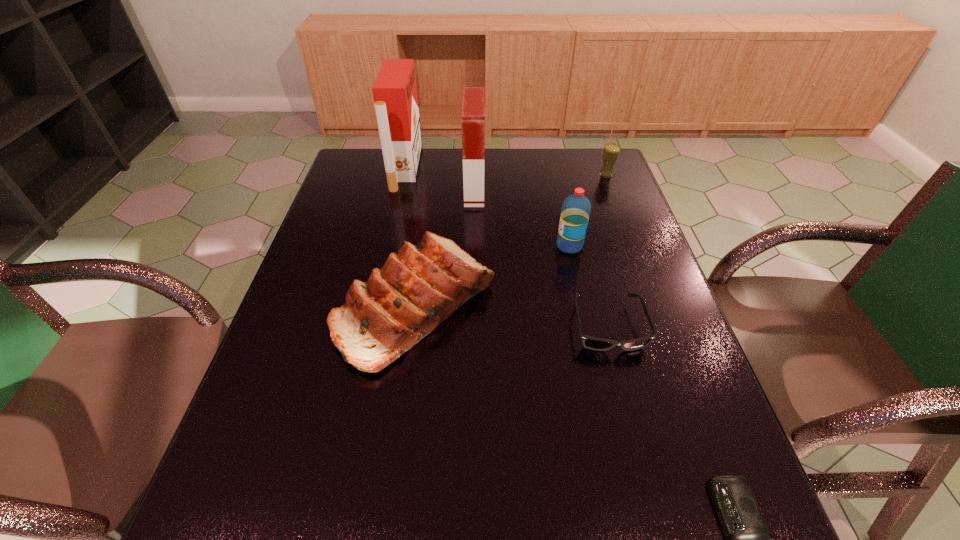
This screenshot has width=960, height=540. Identify the location of vacant area between the left cigarette_case and the sunglasses. (507, 247).

The height and width of the screenshot is (540, 960). I want to click on empty space that is in between the right cigarette_case and the second shortest object, so click(541, 258).

Locate which object ranks in proximity to the left cigarette_case. Please provide its 2D coordinates. Your answer should be formatted as a tuple, i.e. [(x, y)], where the tuple contains the x and y coordinates of a point satisfying the conditions above.

[(473, 103)]

Locate an element on the screen. This screenshot has height=540, width=960. object identified as the fourth closest to the right cigarette_case is located at coordinates (611, 151).

I want to click on vacant space that satisfies the following two spatial constraints: 1. on the back side of the bread; 2. on the front-facing side of the left cigarette_case, so click(x=435, y=168).

You are a GUI agent. You are given a task and a screenshot of the screen. Output one action in this format:
    pyautogui.click(x=<x>, y=<y>)
    Task: Click on the free spot that satisfies the following two spatial constraints: 1. on the front-facing side of the third shortest object; 2. on the left side of the left cigarette_case
    The image size is (960, 540).
    Given the screenshot: What is the action you would take?
    pyautogui.click(x=374, y=305)

The width and height of the screenshot is (960, 540). Find the location of `free region that satisfies the following two spatial constraints: 1. on the front-facing side of the straw for drinking; 2. on the left side of the left cigarette_case`. free region that satisfies the following two spatial constraints: 1. on the front-facing side of the straw for drinking; 2. on the left side of the left cigarette_case is located at coordinates (403, 174).